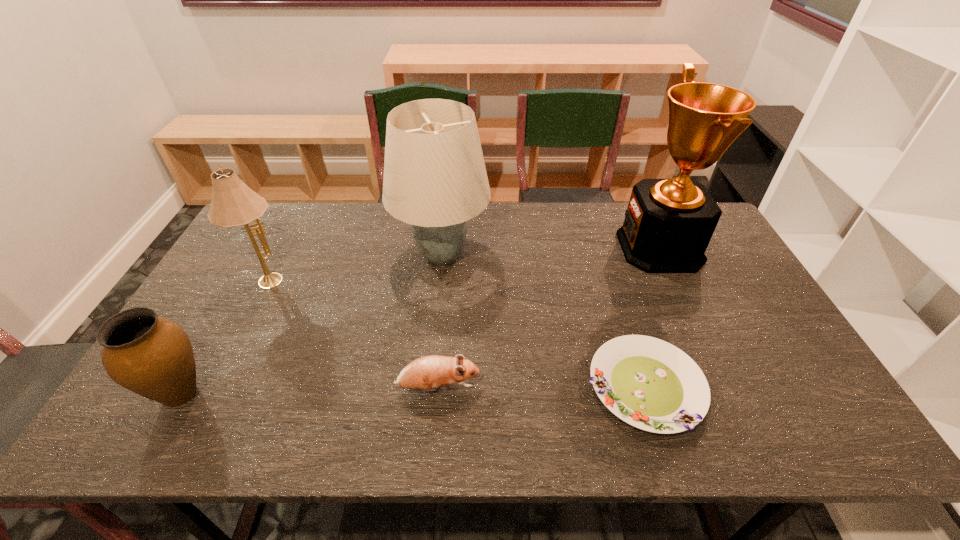
At what (x,y) coordinates should I click in order to perform the action: click on object that ranks as the closest to the urn. Please return your answer as a coordinate pair (x, y). This screenshot has width=960, height=540. Looking at the image, I should click on (233, 203).